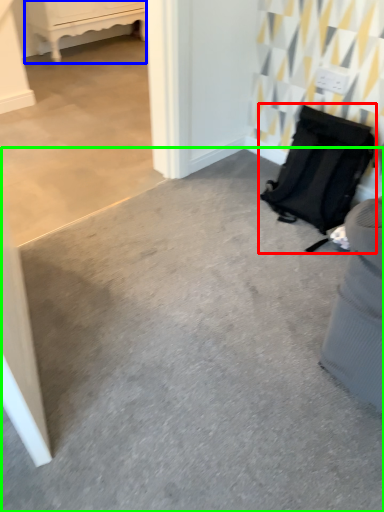
Question: Which object is the closest to the luggage and bags (highlighted by a red box)? Choose among these: furniture (highlighted by a blue box) or concrete (highlighted by a green box).

Choices:
 (A) furniture
 (B) concrete

Answer: (B)